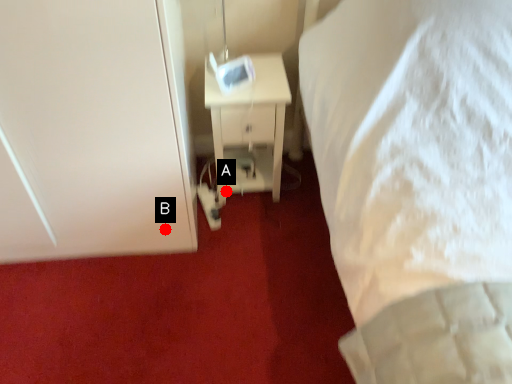
Question: Two points are circled on the image, labeled by A and B beside each circle. Which of the following is the farthest from the observer?

Choices:
 (A) A is further
 (B) B is further

Answer: (A)